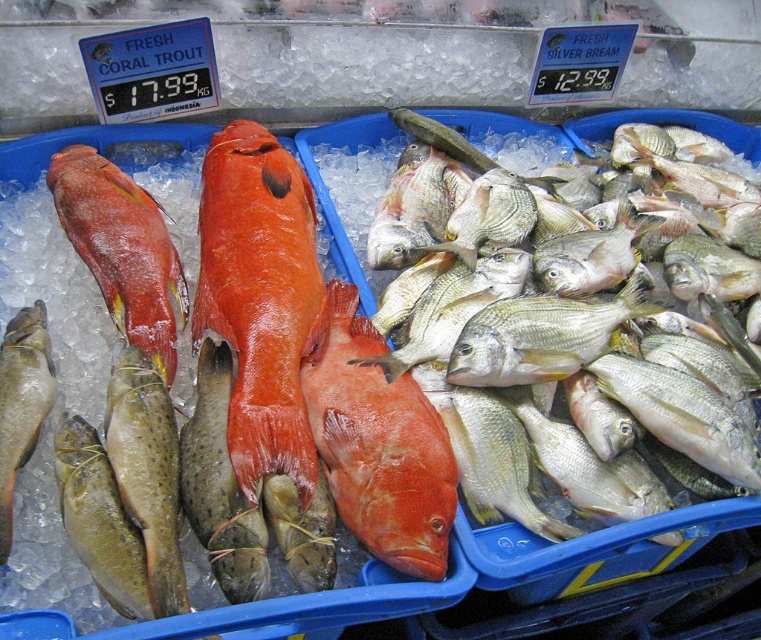
You are a customer at the seafood market and want to buy the larger fish between the spotted green at center and the speckled yellow fish at lower left. Which one should you choose?

The spotted green at center is larger in size than the speckled yellow fish at lower left, so you should choose the spotted green at center.